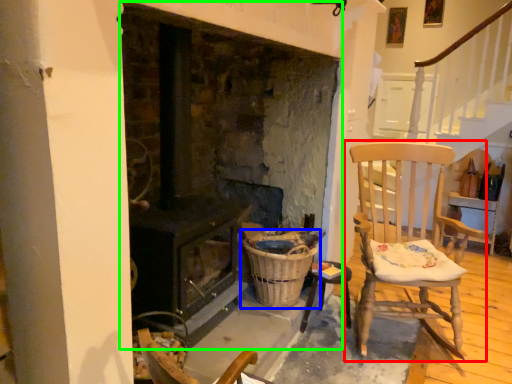
Question: Considering the real-world distances, which object is farthest from chair (highlighted by a red box)? basket (highlighted by a blue box) or fireplace (highlighted by a green box)?

Choices:
 (A) basket
 (B) fireplace

Answer: (B)